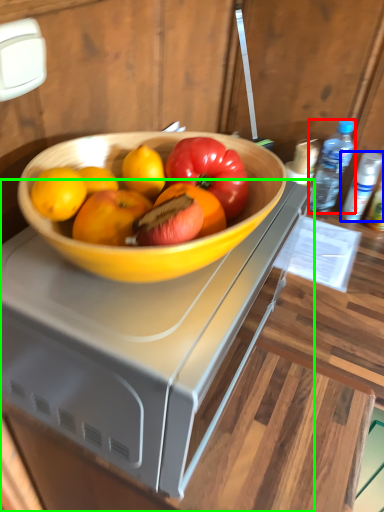
Question: Which object is the farthest from bottle (highlighted by a red box)? Choose among these: bottle (highlighted by a blue box) or desk (highlighted by a green box).

Choices:
 (A) bottle
 (B) desk

Answer: (B)